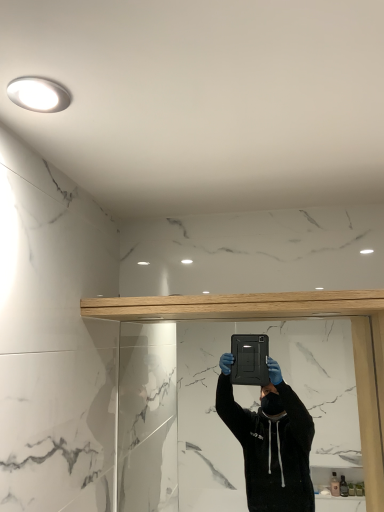
What do you see at coordinates (237, 306) in the screenshot? The image size is (384, 512). I see `light oak wood beam at upper center` at bounding box center [237, 306].

This screenshot has height=512, width=384. Describe the element at coordinates (38, 94) in the screenshot. I see `white glossy light fixture at upper left` at that location.

The image size is (384, 512). What do you see at coordinates (216, 413) in the screenshot?
I see `black matte mirror at center` at bounding box center [216, 413].

Find the location of a particular element. Image resolution: width=384 pixels, height=512 pixels. light oak wood beam at upper center is located at coordinates (237, 306).

Does black matte mirror at center have a greater width compared to white glossy light fixture at upper left?

Incorrect, the width of black matte mirror at center does not surpass that of white glossy light fixture at upper left.

Considering the positions of objects black matte mirror at center and white glossy light fixture at upper left in the image provided, who is in front, black matte mirror at center or white glossy light fixture at upper left?

Positioned in front is white glossy light fixture at upper left.

Does black matte mirror at center turn towards white glossy light fixture at upper left?

No, black matte mirror at center is not facing towards white glossy light fixture at upper left.

Between black matte mirror at center and white glossy light fixture at upper left, which one has larger size?

black matte mirror at center is bigger.

How different are the orientations of white glossy light fixture at upper left and black matte mirror at center in degrees?

1.07 degrees separate the facing orientations of white glossy light fixture at upper left and black matte mirror at center.

Considering the points (27, 78) and (186, 465), which point is behind, point (27, 78) or point (186, 465)?

Point (186, 465)

Is white glossy light fixture at upper left next to black matte mirror at center and touching it?

No, white glossy light fixture at upper left is not beside black matte mirror at center.

From a real-world perspective, is white glossy light fixture at upper left located beneath black matte mirror at center?

Actually, white glossy light fixture at upper left is physically above black matte mirror at center in the real world.

Identify the location of mirror that is under the light oak wood beam at upper center (from a real-world perspective). (216, 413).

Can we say black matte mirror at center lies outside light oak wood beam at upper center?

Yes.

Is black matte mirror at center closer to camera compared to light oak wood beam at upper center?

No, it is not.

Can you confirm if black matte mirror at center is positioned to the left of light oak wood beam at upper center?

In fact, black matte mirror at center is to the right of light oak wood beam at upper center.

Between light oak wood beam at upper center and black matte mirror at center, which one has larger width?

light oak wood beam at upper center.

Is light oak wood beam at upper center located outside black matte mirror at center?

Absolutely, light oak wood beam at upper center is external to black matte mirror at center.

From the picture: Is light oak wood beam at upper center smaller than black matte mirror at center?

Actually, light oak wood beam at upper center might be larger than black matte mirror at center.

Considering the sizes of objects light oak wood beam at upper center and white glossy light fixture at upper left in the image provided, who is thinner, light oak wood beam at upper center or white glossy light fixture at upper left?

white glossy light fixture at upper left is thinner.

Looking at this image, is light oak wood beam at upper center facing away from white glossy light fixture at upper left?

No, white glossy light fixture at upper left is not at the back of light oak wood beam at upper center.

From the image's perspective, does light oak wood beam at upper center appear higher than white glossy light fixture at upper left?

Actually, light oak wood beam at upper center appears below white glossy light fixture at upper left in the image.

In the image, is white glossy light fixture at upper left on the left side or the right side of light oak wood beam at upper center?

Clearly, white glossy light fixture at upper left is on the left of light oak wood beam at upper center in the image.

Would you say white glossy light fixture at upper left is a long distance from light oak wood beam at upper center?

white glossy light fixture at upper left is actually quite close to light oak wood beam at upper center.

Does white glossy light fixture at upper left have a greater width compared to light oak wood beam at upper center?

In fact, white glossy light fixture at upper left might be narrower than light oak wood beam at upper center.

Which object is more forward, white glossy light fixture at upper left or light oak wood beam at upper center?

white glossy light fixture at upper left is in front.

Locate an element on the screen. Image resolution: width=384 pixels, height=512 pixels. mirror below the white glossy light fixture at upper left (from a real-world perspective) is located at coordinates (216, 413).

Find the location of a particular element. The height and width of the screenshot is (512, 384). light fixture above the black matte mirror at center (from a real-world perspective) is located at coordinates (38, 94).

When comparing their distances from light oak wood beam at upper center, does black matte mirror at center or white glossy light fixture at upper left seem further?

Based on the image, white glossy light fixture at upper left appears to be further to light oak wood beam at upper center.

From the image, which object appears to be nearer to black matte mirror at center, light oak wood beam at upper center or white glossy light fixture at upper left?

The object closer to black matte mirror at center is light oak wood beam at upper center.

Looking at this image, which object lies further to the anchor point black matte mirror at center, white glossy light fixture at upper left or light oak wood beam at upper center?

white glossy light fixture at upper left is further to black matte mirror at center.

When comparing their distances from white glossy light fixture at upper left, does light oak wood beam at upper center or black matte mirror at center seem further?

black matte mirror at center is further to white glossy light fixture at upper left.

Which object lies further to the anchor point light oak wood beam at upper center, white glossy light fixture at upper left or black matte mirror at center?

white glossy light fixture at upper left.

Looking at the image, which one is located further to white glossy light fixture at upper left, black matte mirror at center or light oak wood beam at upper center?

Among the two, black matte mirror at center is located further to white glossy light fixture at upper left.

What are the coordinates of `beam that lies between white glossy light fixture at upper left and black matte mirror at center from top to bottom` in the screenshot? It's located at (237, 306).